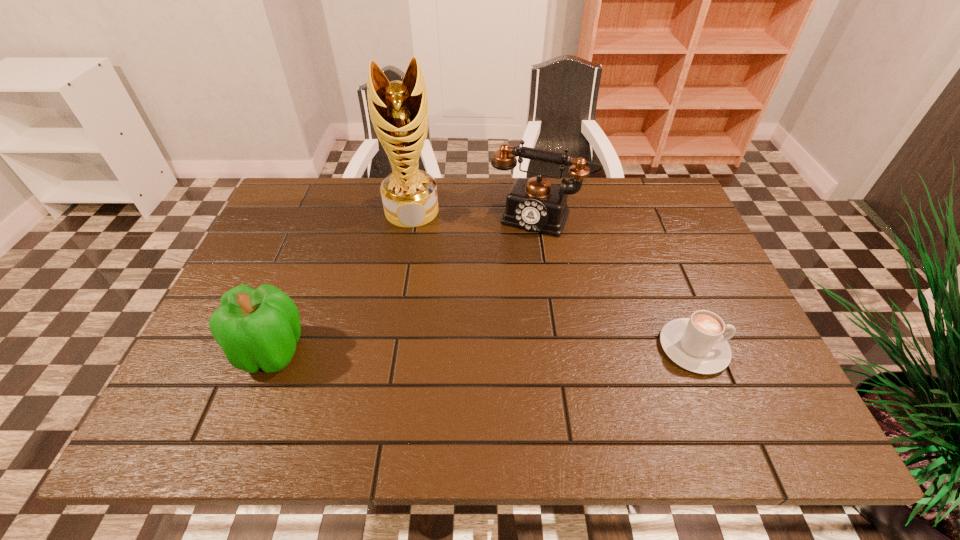
Find the location of `free space located 0.150m on the front of the second object from right to left at the rotary dial`. free space located 0.150m on the front of the second object from right to left at the rotary dial is located at coordinates pos(510,273).

Where is `vacant space located 0.360m on the front of the second object from right to left at the rotary dial`? vacant space located 0.360m on the front of the second object from right to left at the rotary dial is located at coordinates (482, 337).

The height and width of the screenshot is (540, 960). What are the coordinates of `blank space located 0.250m on the front of the second object from right to left at the rotary dial` in the screenshot? It's located at (497, 301).

The image size is (960, 540). In order to click on free space located on the front-facing side of the award in this screenshot , I will do `click(415, 257)`.

Identify the location of vacant region located on the front-facing side of the award. The width and height of the screenshot is (960, 540). (415, 260).

Where is `vacant position located 0.320m on the front-facing side of the award`? vacant position located 0.320m on the front-facing side of the award is located at coordinates (419, 316).

Locate an element on the screen. The height and width of the screenshot is (540, 960). telephone located at the far edge is located at coordinates (534, 204).

Where is `award present at the far edge`? award present at the far edge is located at coordinates (399, 111).

You are a GUI agent. You are given a task and a screenshot of the screen. Output one action in this format:
    pyautogui.click(x=<x>, y=<y>)
    Task: Click on the bell pepper that is at the near edge
    
    Given the screenshot: What is the action you would take?
    click(x=257, y=328)

Find the location of a particular element. Image resolution: width=960 pixels, height=540 pixels. cappuccino positioned at the near edge is located at coordinates (696, 344).